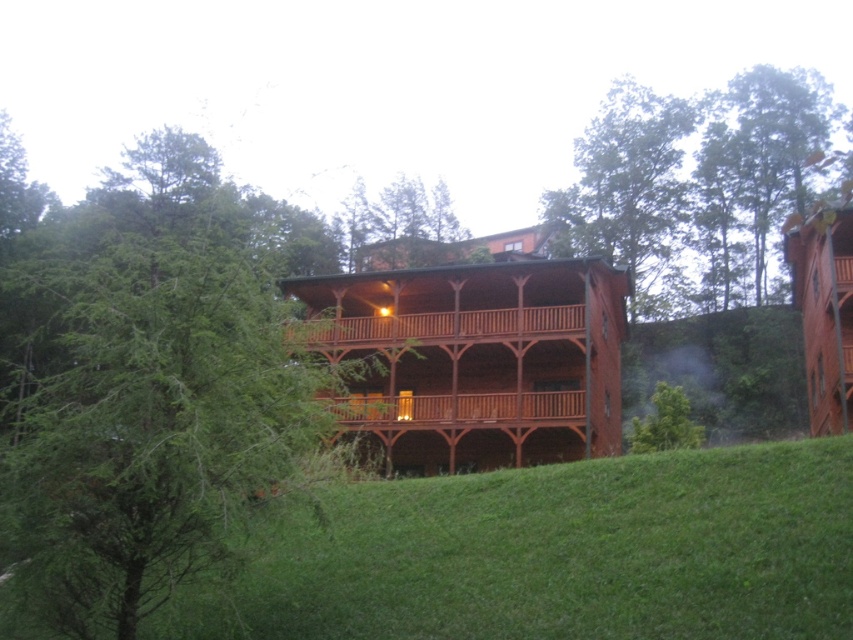
You are standing on the front porch of the two story wooden cabin and looking towards the forest. Which green leafy tree is higher up in your view, the green leafy tree at upper right or the green leafy tree at lower center?

The green leafy tree at upper right is higher up in your view because it is positioned above the green leafy tree at lower center.